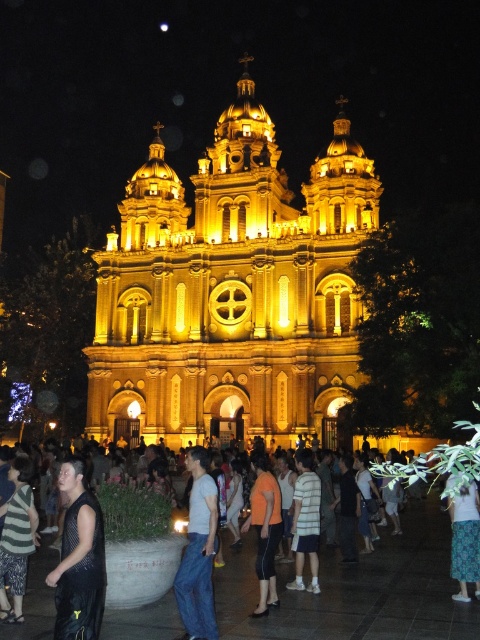
Between point (120, 243) and point (313, 480), which one is positioned behind?

Positioned behind is point (120, 243).

Can you confirm if golden stone church at center is positioned above striped cotton shirt at center?

Indeed, golden stone church at center is positioned over striped cotton shirt at center.

Who is more forward, (153, 301) or (314, 477)?

Point (314, 477) is in front.

Where is `golden stone church at center`? golden stone church at center is located at coordinates (232, 292).

Does striped fabric dress at lower left appear over orange cotton shirt at center?

Correct, striped fabric dress at lower left is located above orange cotton shirt at center.

Can you confirm if striped fabric dress at lower left is positioned below orange cotton shirt at center?

Incorrect, striped fabric dress at lower left is not positioned below orange cotton shirt at center.

This screenshot has height=640, width=480. What are the coordinates of `striped fabric dress at lower left` in the screenshot? It's located at (16, 540).

Does point (32, 572) come farther from viewer compared to point (456, 541)?

Yes, point (32, 572) is farther from viewer.

Does matte black pants at lower center have a greater width compared to printed cotton skirt at lower right?

Yes.

At what (x,y) coordinates should I click in order to perform the action: click on matte black pants at lower center. Please return your answer as a coordinate pair (x, y). This screenshot has height=640, width=480. Looking at the image, I should click on (357, 589).

At what (x,y) coordinates should I click in order to perform the action: click on matte black pants at lower center. Please return your answer as a coordinate pair (x, y). Looking at the image, I should click on point(357,589).